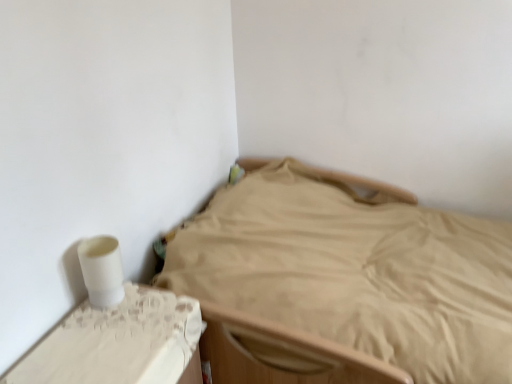
Question: Is beige fabric bed at center to the left or to the right of white lace table at lower left in the image?

Choices:
 (A) right
 (B) left

Answer: (A)

Question: Considering the positions of beige fabric bed at center and white lace table at lower left in the image, is beige fabric bed at center bigger or smaller than white lace table at lower left?

Choices:
 (A) small
 (B) big

Answer: (B)

Question: From a real-world perspective, is beige fabric bed at center above or below white lace table at lower left?

Choices:
 (A) above
 (B) below

Answer: (B)

Question: In terms of height, does white lace table at lower left look taller or shorter compared to beige fabric bed at center?

Choices:
 (A) short
 (B) tall

Answer: (A)

Question: Is point (174, 357) closer or farther from the camera than point (251, 236)?

Choices:
 (A) farther
 (B) closer

Answer: (B)

Question: In terms of width, does white lace table at lower left look wider or thinner when compared to beige fabric bed at center?

Choices:
 (A) wide
 (B) thin

Answer: (B)

Question: Is white lace table at lower left bigger or smaller than beige fabric bed at center?

Choices:
 (A) small
 (B) big

Answer: (A)